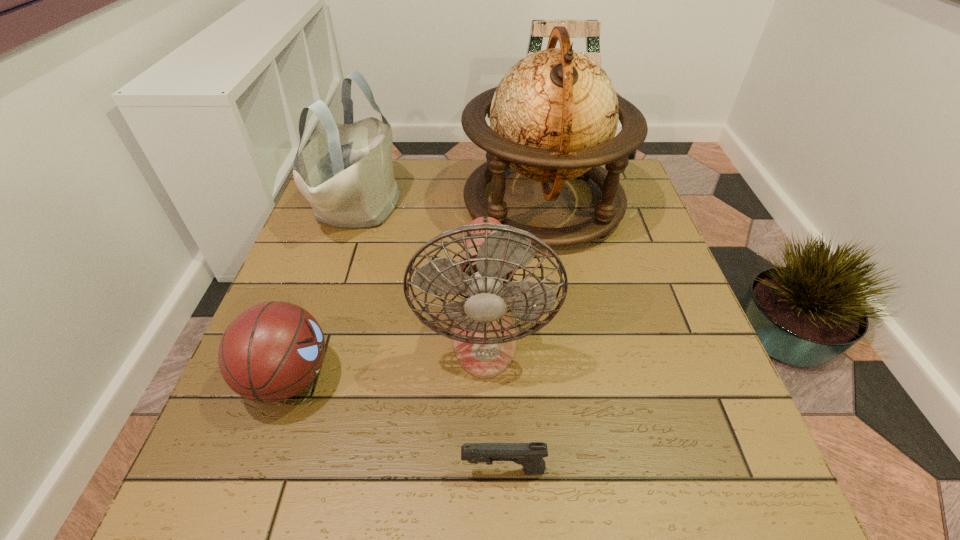
The width and height of the screenshot is (960, 540). I want to click on object that is at the far right corner, so click(x=553, y=117).

Identify the location of vacant space at the far edge. (445, 177).

What are the coordinates of `free space at the near edge of the desktop` in the screenshot? It's located at (394, 466).

In the image, there is a desktop. Identify the location of vacant area at the left edge. The height and width of the screenshot is (540, 960). 213,446.

The width and height of the screenshot is (960, 540). Identify the location of free space at the right edge of the desktop. (636, 385).

Find the location of `free area in between the nearest object and the shopping bag`. free area in between the nearest object and the shopping bag is located at coordinates (432, 339).

Identify the location of vacant space that is in between the basketball and the shortest object. This screenshot has height=540, width=960. (396, 424).

The width and height of the screenshot is (960, 540). I want to click on free space between the nearest object and the shopping bag, so click(432, 339).

Locate an element on the screen. Image resolution: width=960 pixels, height=540 pixels. free spot between the fan and the basketball is located at coordinates (386, 359).

I want to click on blank region between the basketball and the shopping bag, so click(x=324, y=292).